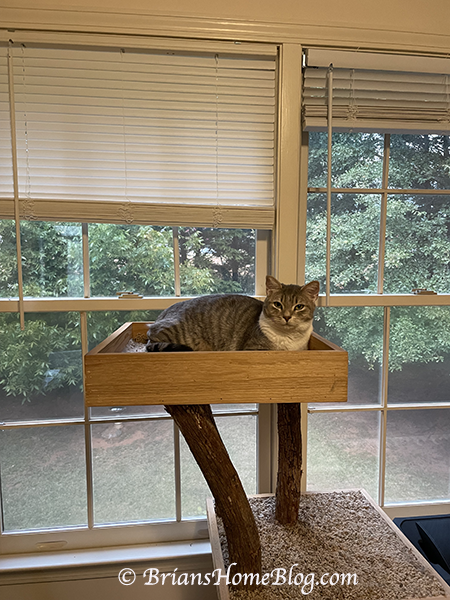
Locate an element on the screen. cat bed is located at coordinates (184, 379).